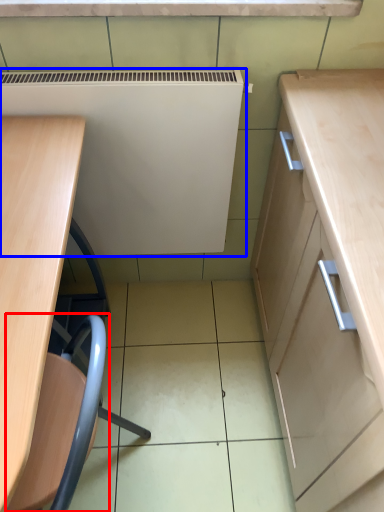
Question: Which object is further to the camera taking this photo, swivel chair (highlighted by a red box) or appliance (highlighted by a blue box)?

Choices:
 (A) swivel chair
 (B) appliance

Answer: (B)